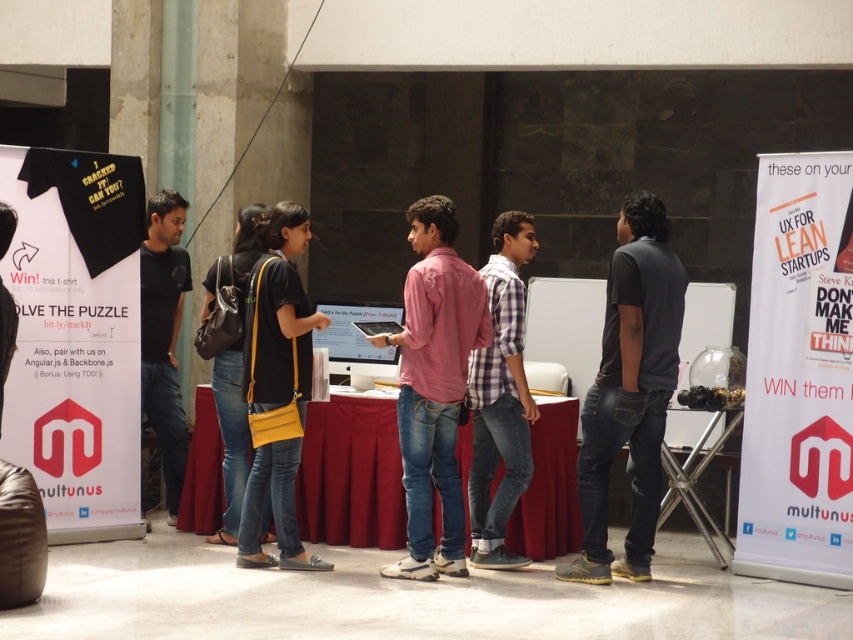
What is the 2D coordinate of the smooth red tablecloth at center?

The smooth red tablecloth at center is located at the 2D coordinate point of (x=351, y=474).